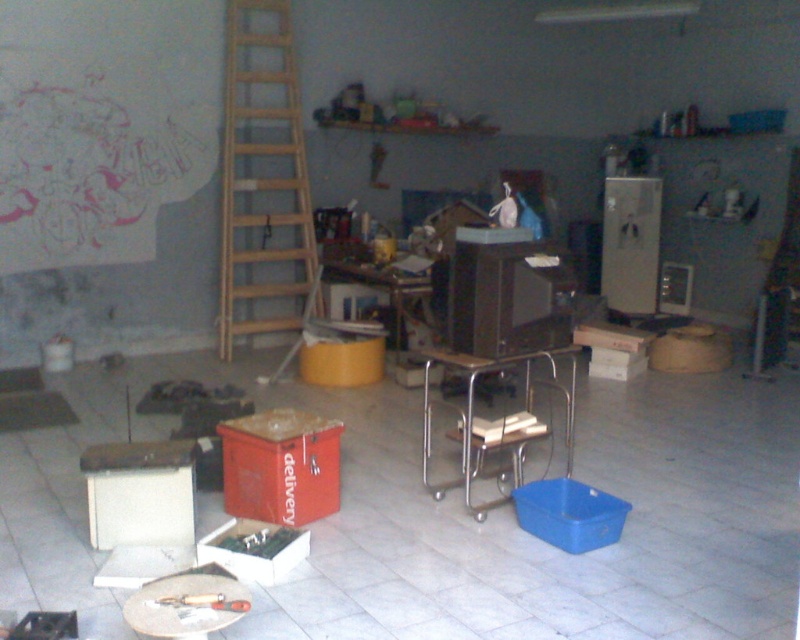
Which of these two, metallic silver tools at center or blue plastic bucket at lower right, stands shorter?

metallic silver tools at center

Does metallic silver tools at center have a greater width compared to blue plastic bucket at lower right?

Correct, the width of metallic silver tools at center exceeds that of blue plastic bucket at lower right.

The width and height of the screenshot is (800, 640). Describe the element at coordinates (186, 604) in the screenshot. I see `metallic silver tools at center` at that location.

The height and width of the screenshot is (640, 800). What are the coordinates of `metallic silver tools at center` in the screenshot? It's located at (186, 604).

This screenshot has width=800, height=640. What do you see at coordinates (262, 173) in the screenshot?
I see `wooden ladder at center-left` at bounding box center [262, 173].

Who is positioned more to the left, wooden ladder at center-left or orange cardboard delivery box at center?

wooden ladder at center-left is more to the left.

Is point (300, 177) farther from viewer compared to point (240, 435)?

Yes, it is.

Identify the location of wooden ladder at center-left. (262, 173).

Consider the image. Which of these two, orange cardboard delivery box at center or metallic silver tools at center, stands taller?

orange cardboard delivery box at center

Based on the photo, is the position of orange cardboard delivery box at center more distant than that of metallic silver tools at center?

Yes, it is.

The width and height of the screenshot is (800, 640). In order to click on orange cardboard delivery box at center in this screenshot , I will do `click(280, 467)`.